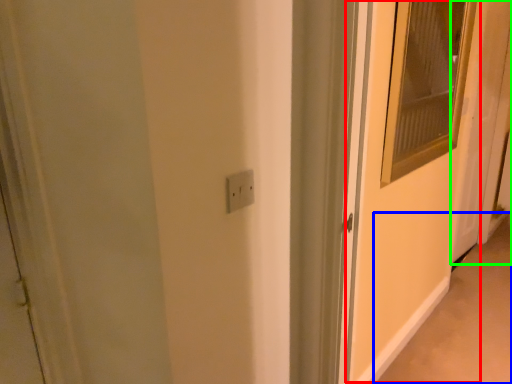
Question: Which is nearer to the screen door (highlighted by a red box)? alley (highlighted by a blue box) or door (highlighted by a green box).

Choices:
 (A) alley
 (B) door

Answer: (A)